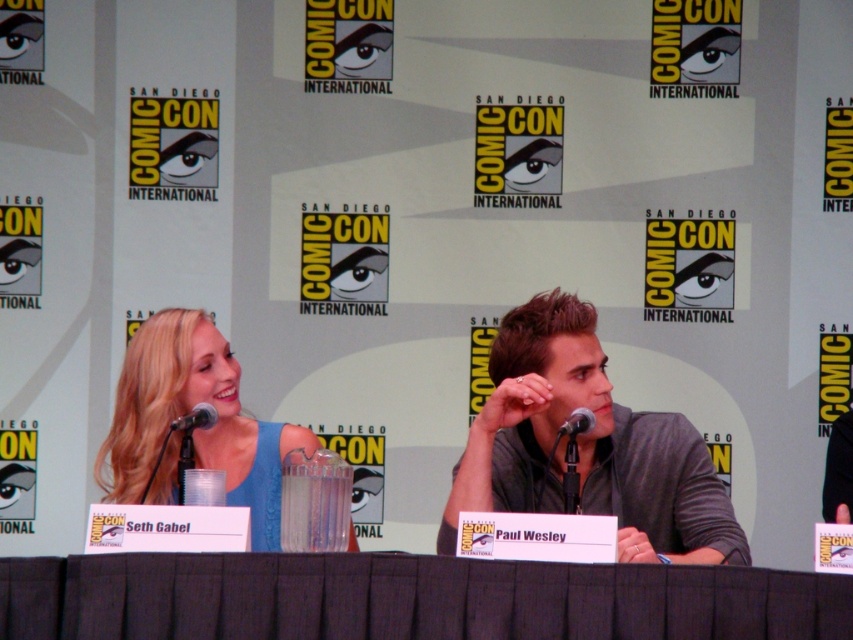
Is black fabric table at center above blue satin dress at center?

Actually, black fabric table at center is below blue satin dress at center.

Measure the distance from black fabric table at center to blue satin dress at center.

black fabric table at center and blue satin dress at center are 33.46 inches apart.

Locate an element on the screen. The height and width of the screenshot is (640, 853). black fabric table at center is located at coordinates (407, 598).

Is black fabric table at center taller than black metallic microphone at left?

Yes.

Is point (561, 586) positioned behind point (195, 410)?

No.

You are a GUI agent. You are given a task and a screenshot of the screen. Output one action in this format:
    pyautogui.click(x=<x>, y=<y>)
    Task: Click on the black fabric table at center
    This screenshot has width=853, height=640.
    Given the screenshot: What is the action you would take?
    pyautogui.click(x=407, y=598)

At what (x,y) coordinates should I click in order to perform the action: click on black fabric table at center. Please return your answer as a coordinate pair (x, y). This screenshot has height=640, width=853. Looking at the image, I should click on (407, 598).

Identify the location of gray matte shirt at center. (587, 445).

Can you confirm if gray matte shirt at center is wider than blue satin dress at center?

No, gray matte shirt at center is not wider than blue satin dress at center.

I want to click on gray matte shirt at center, so click(x=587, y=445).